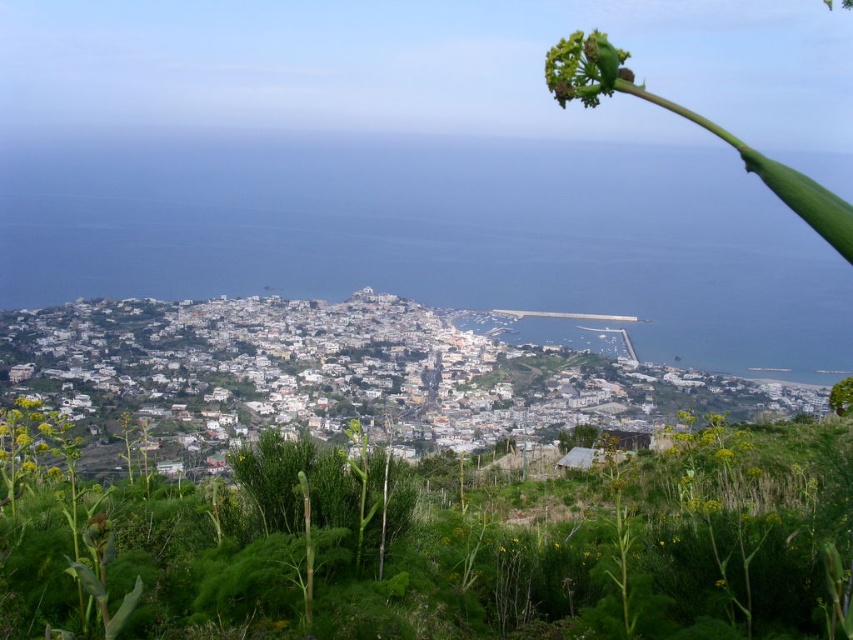
Question: Is green leafy plant at center below green fuzzy flower at upper center?

Choices:
 (A) no
 (B) yes

Answer: (B)

Question: Which point is closer to the camera taking this photo?

Choices:
 (A) (10, 467)
 (B) (563, 72)

Answer: (B)

Question: Does green leafy plant at center appear under green fuzzy flower at upper center?

Choices:
 (A) no
 (B) yes

Answer: (B)

Question: Which of the following is the closest to the observer?

Choices:
 (A) (61, 464)
 (B) (561, 97)
 (C) (102, 520)

Answer: (C)

Question: Which point is closer to the camera taking this photo?

Choices:
 (A) (548, 65)
 (B) (811, 493)
 (C) (50, 424)

Answer: (B)

Question: Does green fuzzy flower at upper center have a larger size compared to green leafy plant at lower left?

Choices:
 (A) yes
 (B) no

Answer: (B)